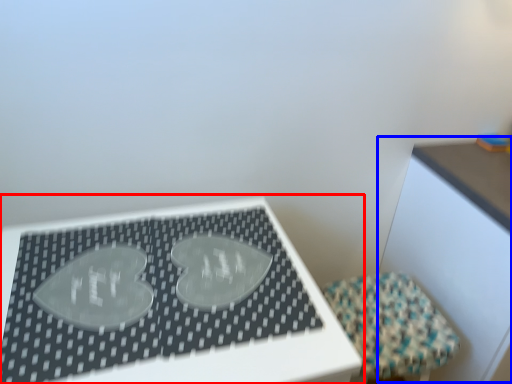
Question: Which of the following is the farthest to the observer, table (highlighted by a red box) or table (highlighted by a blue box)?

Choices:
 (A) table
 (B) table

Answer: (B)